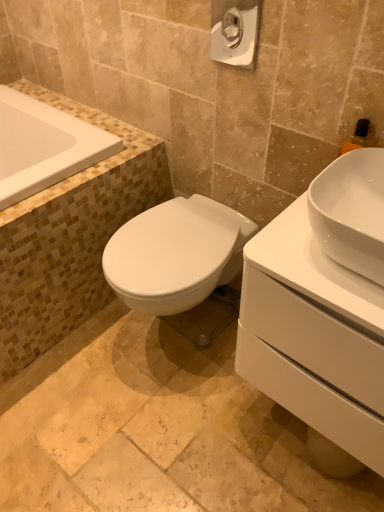
Question: Is white glossy toilet paper at upper center surrounding white glossy sink at right?

Choices:
 (A) yes
 (B) no

Answer: (B)

Question: Does white glossy toilet paper at upper center have a greater height compared to white glossy sink at right?

Choices:
 (A) no
 (B) yes

Answer: (A)

Question: Is white glossy toilet paper at upper center turned away from white glossy sink at right?

Choices:
 (A) no
 (B) yes

Answer: (A)

Question: Considering the relative sizes of white glossy toilet paper at upper center and white glossy sink at right in the image provided, is white glossy toilet paper at upper center bigger than white glossy sink at right?

Choices:
 (A) no
 (B) yes

Answer: (A)

Question: Can you confirm if white glossy toilet paper at upper center is positioned to the right of white glossy sink at right?

Choices:
 (A) yes
 (B) no

Answer: (B)

Question: Is there a large distance between white glossy toilet paper at upper center and white glossy sink at right?

Choices:
 (A) no
 (B) yes

Answer: (A)

Question: Is white glossy sink at right in front of white glossy bathtub at upper left?

Choices:
 (A) no
 (B) yes

Answer: (B)

Question: Could white glossy bathtub at upper left be considered to be inside white glossy sink at right?

Choices:
 (A) yes
 (B) no

Answer: (B)

Question: Can you confirm if white glossy sink at right is positioned to the left of white glossy bathtub at upper left?

Choices:
 (A) no
 (B) yes

Answer: (A)

Question: From the image's perspective, is white glossy sink at right located beneath white glossy bathtub at upper left?

Choices:
 (A) no
 (B) yes

Answer: (B)

Question: From a real-world perspective, is white glossy sink at right under white glossy bathtub at upper left?

Choices:
 (A) no
 (B) yes

Answer: (B)

Question: Can you confirm if white glossy sink at right is taller than white glossy bathtub at upper left?

Choices:
 (A) yes
 (B) no

Answer: (A)

Question: Considering the relative sizes of white glossy sink at right and white glossy toilet paper at upper center in the image provided, is white glossy sink at right thinner than white glossy toilet paper at upper center?

Choices:
 (A) no
 (B) yes

Answer: (A)